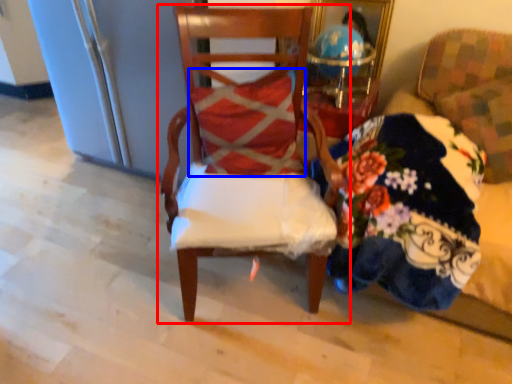
Question: Which of the following is the closest to the observer, chair (highlighted by a red box) or pillow (highlighted by a blue box)?

Choices:
 (A) chair
 (B) pillow

Answer: (A)